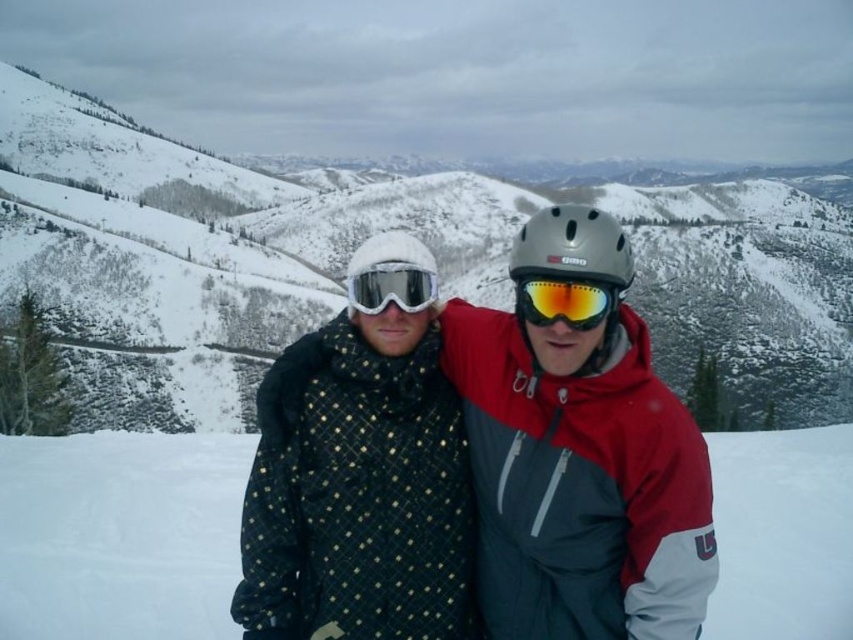
You are a photographer standing at the base of the mountain. You want to take a photo of the shiny orange ski goggles at center and the matte black goggles at center. If your camera has a maximum focus range of 8 meters, will both objects be in focus?

The shiny orange ski goggles at center is 8.19 meters away from matte black goggles at center. Since the camera can only focus up to 8 meters, the distance between them exceeds the focus range, so both objects might not be in focus simultaneously.

You are planning to take a photo of the two individuals in the snowy landscape. There is a white fleece hat at center. To ensure both people are in the frame, should you move the hat to the left or right? Please explain based on their positions.

The white fleece hat at center is located at point (392, 291). Since both individuals are positioned to the left and right of the hat, moving it towards either direction would move it away from the center. To keep both people in the frame, the hat should remain centered between them.

You are a photographer trying to capture a photo of both the quilted fabric jacket at center and the black quilted jacket at center. Which jacket should you focus on first to ensure both are in clear view?

You should focus on the quilted fabric jacket at center first since it is closer to the viewer than the black quilted jacket at center. By focusing on the closer jacket, the depth of field may allow the farther jacket to remain in acceptable focus, ensuring both are clear.